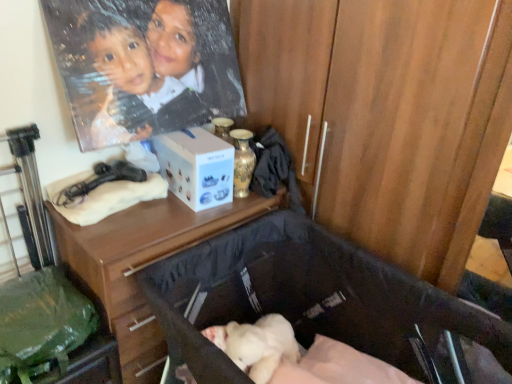
Locate an element on the screen. empty space that is to the right of matte black hairdryer at upper left is located at coordinates (155, 210).